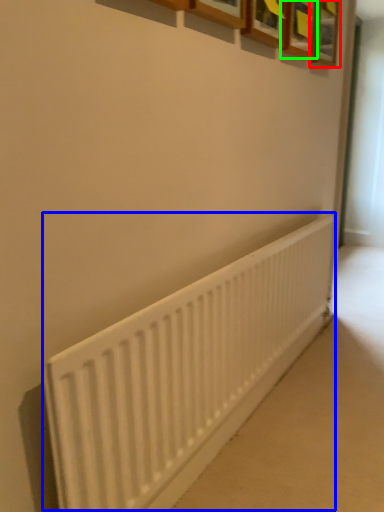
Question: Estimate the real-world distances between objects in this image. Which object is farther from picture frame (highlighted by a red box), radiator (highlighted by a blue box) or picture frame (highlighted by a green box)?

Choices:
 (A) radiator
 (B) picture frame

Answer: (A)